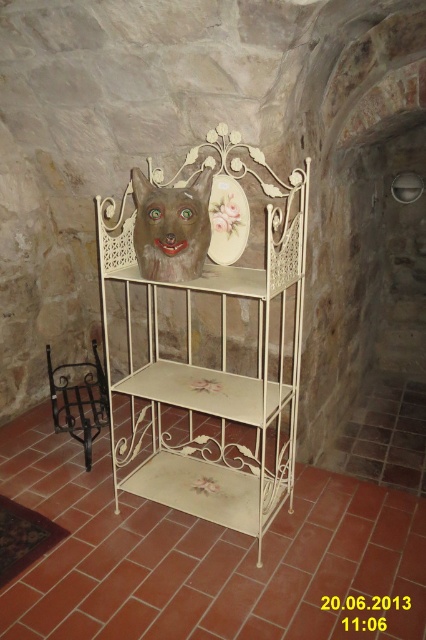
You are standing in a room with a white painted metal shelf at center. If you want to place a 3 feet tall vase on the shelf, will you be able to reach it without any assistance?

The white painted metal shelf at center is 5.25 feet away from the viewer. Since the distance is horizontal, the height of the shelf isn???t provided, so it???s unclear if the 3 feet tall vase will fit vertically or if the shelf is high enough to reach. The question can???t be answered with the given information.

You are an interior designer arranging items on the white wrought iron shelf at center and the matte ceramic mask at center. Which object is closer to you when standing in front of the shelving unit?

The white wrought iron shelf at center is closer to you because it is in front of the matte ceramic mask at center.